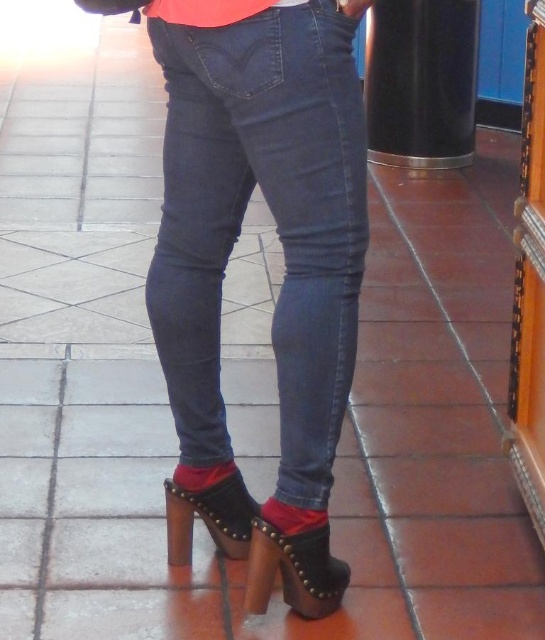
The width and height of the screenshot is (545, 640). Describe the element at coordinates (420, 81) in the screenshot. I see `black glossy pillar at upper right` at that location.

Locate an element on the screen. The height and width of the screenshot is (640, 545). black glossy pillar at upper right is located at coordinates (420, 81).

Which is in front, point (316, 406) or point (218, 474)?

Positioned in front is point (316, 406).

Who is positioned more to the right, denim jeans at center or leather studded sandal at lower center?

From the viewer's perspective, denim jeans at center appears more on the right side.

Is point (166, 320) positioned before point (190, 518)?

That is True.

The image size is (545, 640). What are the coordinates of `denim jeans at center` in the screenshot? It's located at (274, 218).

Does black glossy pillar at upper right have a greater width compared to studded leather sandal at lower center?

Correct, the width of black glossy pillar at upper right exceeds that of studded leather sandal at lower center.

Does black glossy pillar at upper right lie behind studded leather sandal at lower center?

That is True.

Does point (408, 45) come farther from viewer compared to point (286, 536)?

Yes.

This screenshot has width=545, height=640. I want to click on black glossy pillar at upper right, so click(420, 81).